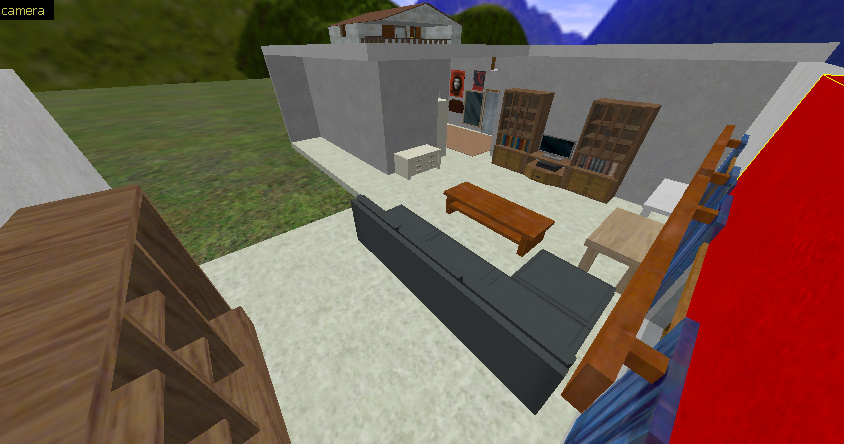
Locate an element on the screen. monitor is located at coordinates (560, 140).